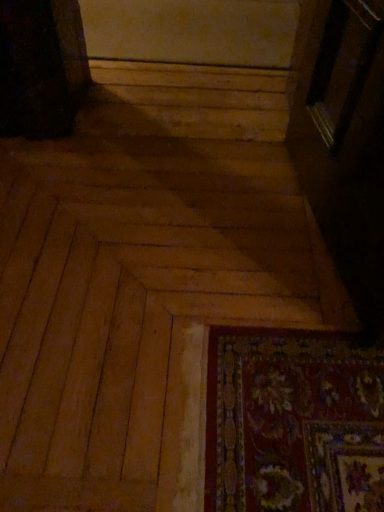
The width and height of the screenshot is (384, 512). What are the coordinates of `wooden screen door at right` in the screenshot? It's located at (346, 145).

What do you see at coordinates (346, 145) in the screenshot? The width and height of the screenshot is (384, 512). I see `wooden screen door at right` at bounding box center [346, 145].

In order to face wooden screen door at right, should I rotate leftwards or rightwards?

Rotate your view right by about 21.569°.

Locate an element on the screen. wooden screen door at right is located at coordinates (346, 145).